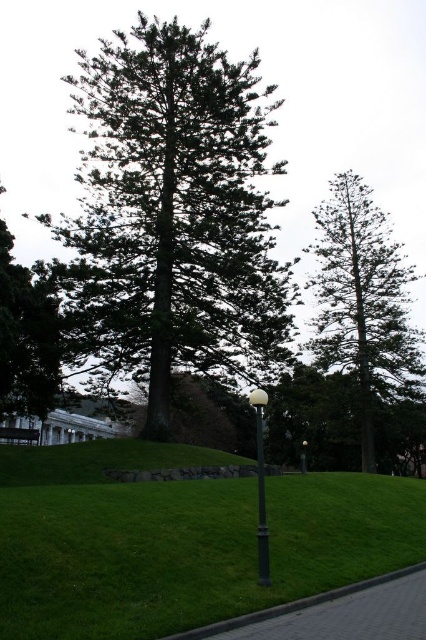
Based on the photo, you are a gardener who needs to trim the green textured tree at center and the brick pavement at lower center. Since you can only trim objects that are taller than 2 meters, can you trim both?

The green textured tree at center is taller than brick pavement at lower center. The brick pavement at lower center is likely shorter than 2 meters, so you can only trim the green textured tree at center.

You are a city planner reviewing a design for a new park. The design includes two lamp posts in the center. The black metal lamp post at center and the matte black lamp post at center. Based on the design, which lamp post is taller?

The black metal lamp post at center is taller than the matte black lamp post at center according to the design.